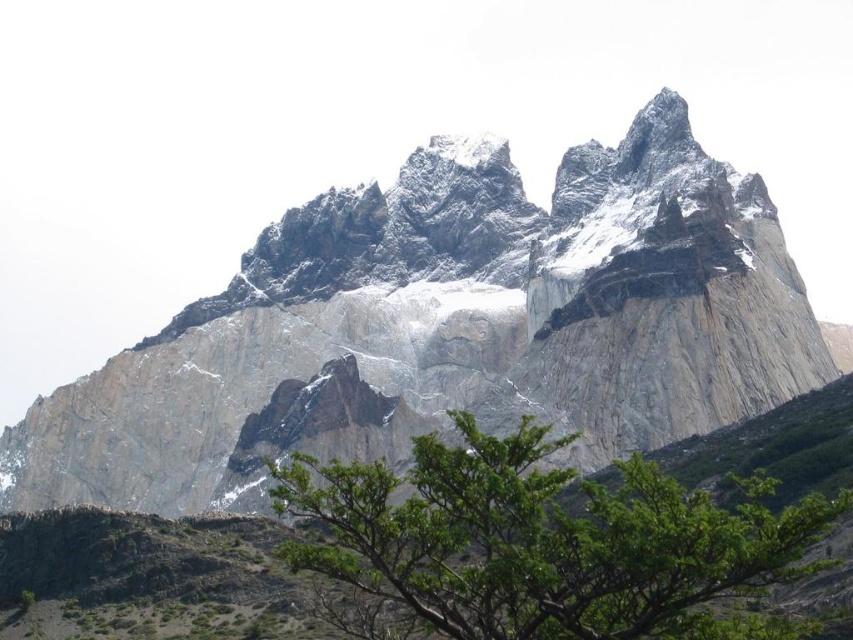
Which is behind, point (483, 362) or point (332, 548)?

The point (483, 362) is behind.

Does rugged stone mountain range at upper center have a greater height compared to green leafy tree at center?

Yes, rugged stone mountain range at upper center is taller than green leafy tree at center.

Is point (752, 289) behind point (453, 518)?

Yes.

Image resolution: width=853 pixels, height=640 pixels. Find the location of `rugged stone mountain range at upper center`. rugged stone mountain range at upper center is located at coordinates (453, 323).